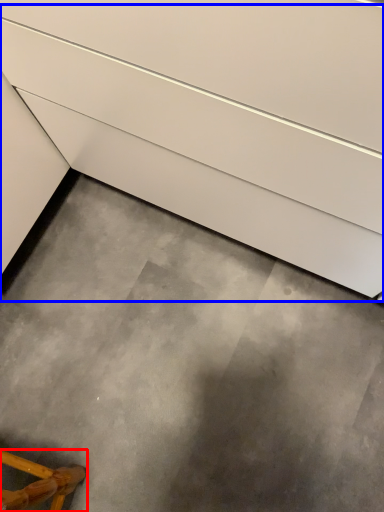
Question: Among these objects, which one is nearest to the camera, furniture (highlighted by a red box) or stairs (highlighted by a blue box)?

Choices:
 (A) furniture
 (B) stairs

Answer: (B)